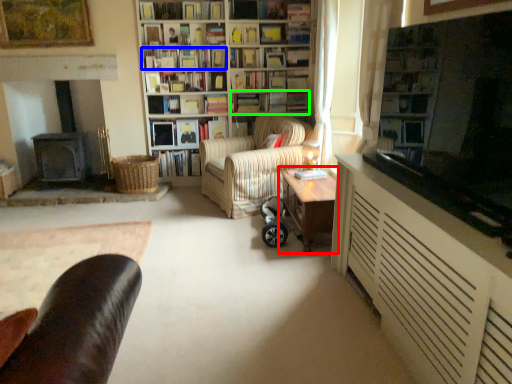
Question: Considering the real-world distances, which object is closest to table (highlighted by a red box)? book (highlighted by a blue box) or book (highlighted by a green box).

Choices:
 (A) book
 (B) book

Answer: (B)